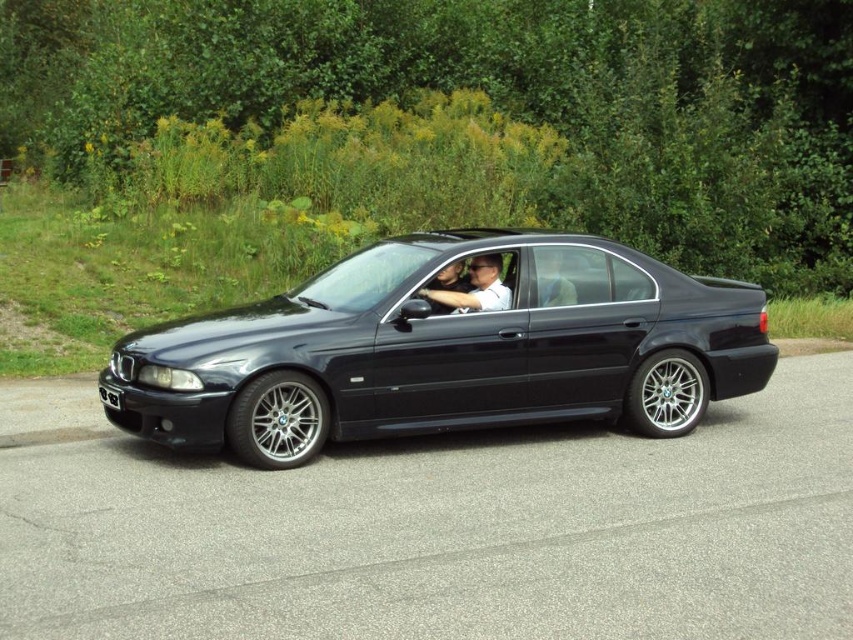
Question: Which point is closer to the camera?

Choices:
 (A) glossy black car at center
 (B) matte black car at center
 (C) matte black car door at center

Answer: (A)

Question: Is matte black car door at center closer to camera compared to black plastic license plate at lower left?

Choices:
 (A) no
 (B) yes

Answer: (A)

Question: Which point is closer to the camera?

Choices:
 (A) (550, 292)
 (B) (114, 397)
 (C) (450, 296)

Answer: (B)

Question: Does matte black car at center appear over matte black car door at center?

Choices:
 (A) no
 (B) yes

Answer: (A)

Question: Is matte black car at center to the left of black plastic license plate at lower left from the viewer's perspective?

Choices:
 (A) yes
 (B) no

Answer: (B)

Question: Which of these objects is positioned farthest from the matte black car door at center?

Choices:
 (A) matte black car at center
 (B) black plastic license plate at lower left

Answer: (B)